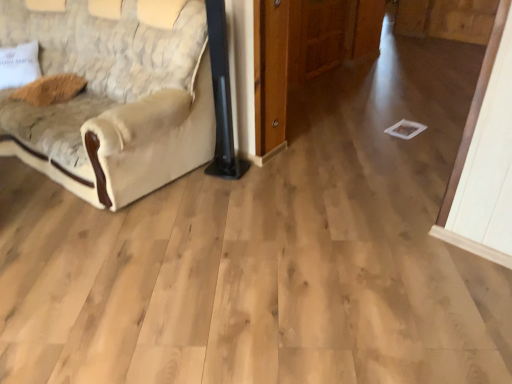
The height and width of the screenshot is (384, 512). I want to click on beige textured pillow at left, the second pillow in the right-to-left sequence, so click(x=19, y=65).

Where is `beige textured pillow at left, placed as the first pillow when sorted from left to right`? The height and width of the screenshot is (384, 512). beige textured pillow at left, placed as the first pillow when sorted from left to right is located at coordinates (19, 65).

Consider the image. How much distance is there between beige fabric couch at left and beige textured pillow at left, the second pillow in the right-to-left sequence?

beige fabric couch at left is 27.92 inches from beige textured pillow at left, the second pillow in the right-to-left sequence.

Consider the image. Does beige fabric couch at left touch beige textured pillow at left, placed as the first pillow when sorted from left to right?

beige fabric couch at left is not next to beige textured pillow at left, placed as the first pillow when sorted from left to right, and they're not touching.

Consider the image. Does beige fabric couch at left appear on the right side of beige textured pillow at left, the second pillow in the right-to-left sequence?

Yes, beige fabric couch at left is to the right of beige textured pillow at left, the second pillow in the right-to-left sequence.

From the image's perspective, is beige fabric couch at left below beige textured pillow at left, placed as the first pillow when sorted from left to right?

Yes.

Does brown fuzzy pillow at upper left, acting as the 2th pillow starting from the left, have a greater width compared to beige textured pillow at left, the second pillow in the right-to-left sequence?

Yes.

Does brown fuzzy pillow at upper left, the first pillow viewed from the right, appear on the left side of beige textured pillow at left, the second pillow in the right-to-left sequence?

Incorrect, brown fuzzy pillow at upper left, the first pillow viewed from the right, is not on the left side of beige textured pillow at left, the second pillow in the right-to-left sequence.

Is point (22, 93) positioned in front of point (6, 85)?

Yes, point (22, 93) is in front of point (6, 85).

Is brown fuzzy pillow at upper left, the first pillow viewed from the right, with beige textured pillow at left, placed as the first pillow when sorted from left to right?

No, brown fuzzy pillow at upper left, the first pillow viewed from the right, is not next to beige textured pillow at left, placed as the first pillow when sorted from left to right.

From the image's perspective, between beige fabric couch at left and brown fuzzy pillow at upper left, the first pillow viewed from the right, which one is located above?

beige fabric couch at left, from the image's perspective.

Looking at the image, does beige fabric couch at left seem bigger or smaller compared to brown fuzzy pillow at upper left, the first pillow viewed from the right?

beige fabric couch at left is bigger than brown fuzzy pillow at upper left, the first pillow viewed from the right.

Considering the positions of objects beige fabric couch at left and brown fuzzy pillow at upper left, acting as the 2th pillow starting from the left, in the image provided, who is behind, beige fabric couch at left or brown fuzzy pillow at upper left, acting as the 2th pillow starting from the left,?

Positioned behind is brown fuzzy pillow at upper left, acting as the 2th pillow starting from the left.

Could you tell me if beige fabric couch at left is facing brown fuzzy pillow at upper left, the first pillow viewed from the right?

Yes, beige fabric couch at left is aimed at brown fuzzy pillow at upper left, the first pillow viewed from the right.

Is brown fuzzy pillow at upper left, acting as the 2th pillow starting from the left, oriented away from beige fabric couch at left?

Yes.

Based on the photo, from the image's perspective, does brown fuzzy pillow at upper left, the first pillow viewed from the right, appear higher than beige fabric couch at left?

No, from the image's perspective, brown fuzzy pillow at upper left, the first pillow viewed from the right, is not above beige fabric couch at left.

Is the position of brown fuzzy pillow at upper left, acting as the 2th pillow starting from the left, more distant than that of beige fabric couch at left?

Yes, brown fuzzy pillow at upper left, acting as the 2th pillow starting from the left, is further from the viewer.

Can you confirm if brown fuzzy pillow at upper left, the first pillow viewed from the right, is positioned to the left of beige fabric couch at left?

Yes.

Which object is positioned more to the left, beige textured pillow at left, the second pillow in the right-to-left sequence, or brown fuzzy pillow at upper left, acting as the 2th pillow starting from the left?

beige textured pillow at left, the second pillow in the right-to-left sequence.

How much distance is there between beige textured pillow at left, placed as the first pillow when sorted from left to right, and brown fuzzy pillow at upper left, the first pillow viewed from the right?

beige textured pillow at left, placed as the first pillow when sorted from left to right, is 9.89 inches from brown fuzzy pillow at upper left, the first pillow viewed from the right.

Can you confirm if beige textured pillow at left, placed as the first pillow when sorted from left to right, is shorter than brown fuzzy pillow at upper left, the first pillow viewed from the right?

Incorrect, the height of beige textured pillow at left, placed as the first pillow when sorted from left to right, does not fall short of that of brown fuzzy pillow at upper left, the first pillow viewed from the right.

Which object is thinner, beige textured pillow at left, placed as the first pillow when sorted from left to right, or brown fuzzy pillow at upper left, acting as the 2th pillow starting from the left?

beige textured pillow at left, placed as the first pillow when sorted from left to right, is thinner.

Is beige textured pillow at left, the second pillow in the right-to-left sequence, to the left of beige fabric couch at left from the viewer's perspective?

Yes.

Does point (3, 75) come closer to viewer compared to point (183, 11)?

That is False.

From the image's perspective, is beige textured pillow at left, the second pillow in the right-to-left sequence, located above or below beige fabric couch at left?

From the image's perspective, beige textured pillow at left, the second pillow in the right-to-left sequence, appears above beige fabric couch at left.

Can you confirm if beige textured pillow at left, placed as the first pillow when sorted from left to right, is taller than beige fabric couch at left?

Incorrect, the height of beige textured pillow at left, placed as the first pillow when sorted from left to right, is not larger of that of beige fabric couch at left.

This screenshot has width=512, height=384. In order to click on studio couch above the beige textured pillow at left, the second pillow in the right-to-left sequence (from a real-world perspective) in this screenshot , I will do (114, 97).

Find the location of a particular element. pillow below the beige textured pillow at left, placed as the first pillow when sorted from left to right (from the image's perspective) is located at coordinates (51, 89).

Consider the image. From the image, which object appears to be nearer to beige textured pillow at left, the second pillow in the right-to-left sequence, brown fuzzy pillow at upper left, the first pillow viewed from the right, or beige fabric couch at left?

brown fuzzy pillow at upper left, the first pillow viewed from the right.

From the image, which object appears to be nearer to beige textured pillow at left, placed as the first pillow when sorted from left to right, beige fabric couch at left or brown fuzzy pillow at upper left, acting as the 2th pillow starting from the left?

Based on the image, brown fuzzy pillow at upper left, acting as the 2th pillow starting from the left, appears to be nearer to beige textured pillow at left, placed as the first pillow when sorted from left to right.

Which object lies further to the anchor point beige fabric couch at left, brown fuzzy pillow at upper left, acting as the 2th pillow starting from the left, or beige textured pillow at left, the second pillow in the right-to-left sequence?

The object further to beige fabric couch at left is beige textured pillow at left, the second pillow in the right-to-left sequence.

Estimate the real-world distances between objects in this image. Which object is further from beige fabric couch at left, beige textured pillow at left, the second pillow in the right-to-left sequence, or brown fuzzy pillow at upper left, the first pillow viewed from the right?

beige textured pillow at left, the second pillow in the right-to-left sequence, lies further to beige fabric couch at left than the other object.

Based on their spatial positions, is beige fabric couch at left or beige textured pillow at left, the second pillow in the right-to-left sequence, further from brown fuzzy pillow at upper left, the first pillow viewed from the right?

beige fabric couch at left lies further to brown fuzzy pillow at upper left, the first pillow viewed from the right, than the other object.

In the scene shown: Estimate the real-world distances between objects in this image. Which object is closer to brown fuzzy pillow at upper left, acting as the 2th pillow starting from the left, beige textured pillow at left, placed as the first pillow when sorted from left to right, or beige fabric couch at left?

Based on the image, beige textured pillow at left, placed as the first pillow when sorted from left to right, appears to be nearer to brown fuzzy pillow at upper left, acting as the 2th pillow starting from the left.

I want to click on pillow between beige fabric couch at left and beige textured pillow at left, the second pillow in the right-to-left sequence, from front to back, so click(x=51, y=89).